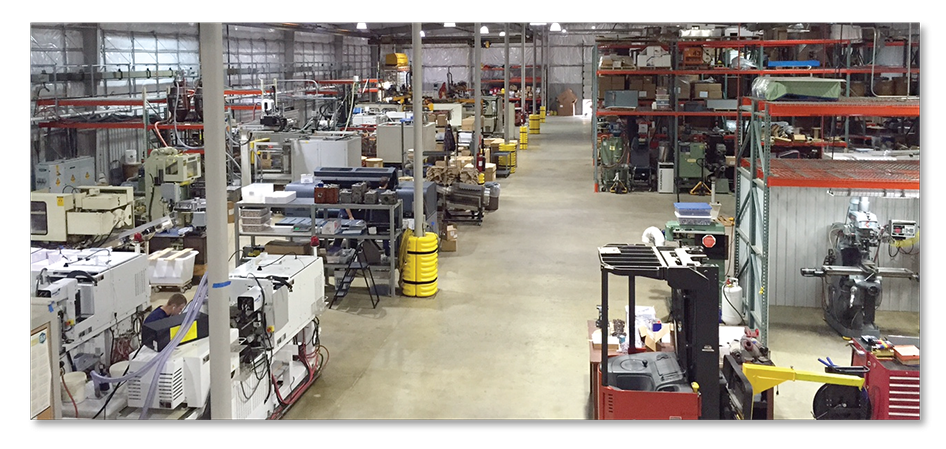
Where is `wood stools`? wood stools is located at coordinates (370, 160), (360, 154).